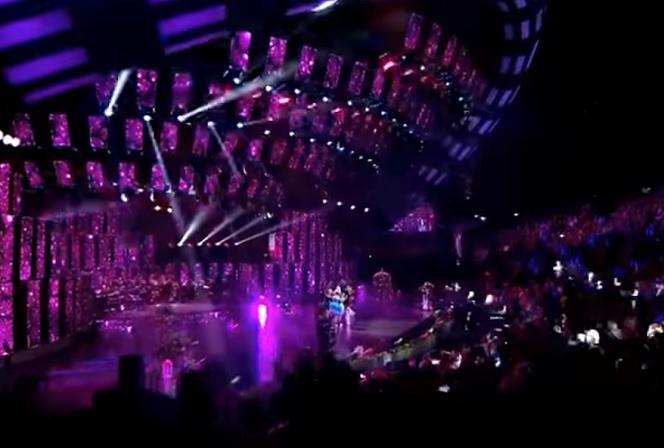
Where is `lights`? lights is located at coordinates (481, 217).